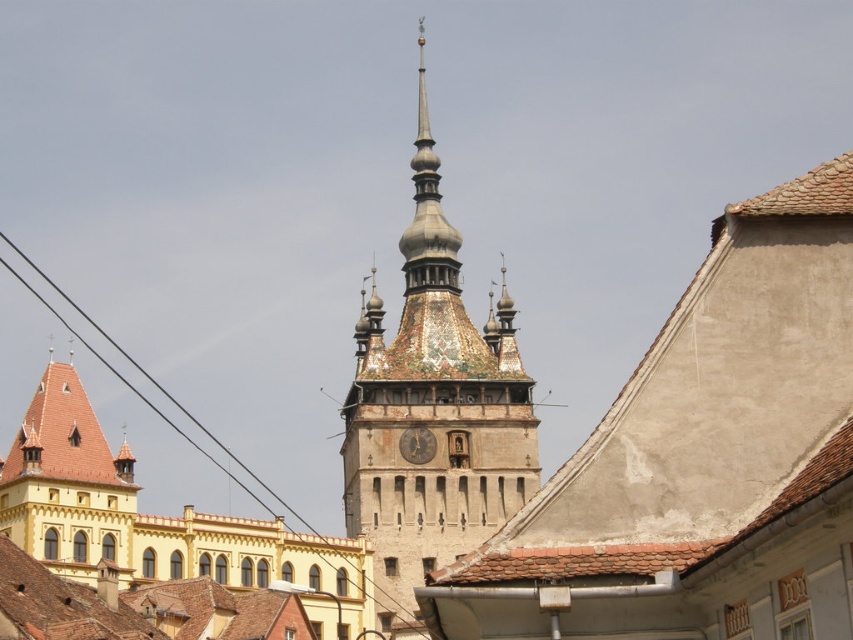
Can you confirm if multicolored mosaic clock tower at center is shorter than gold textured clock at center?

No.

Where is `multicolored mosaic clock tower at center`? The image size is (853, 640). multicolored mosaic clock tower at center is located at coordinates (433, 408).

Is point (477, 493) in front of point (329, 566)?

That is False.

Which is below, multicolored mosaic clock tower at center or yellow brick building at left?

Positioned lower is yellow brick building at left.

You are a GUI agent. You are given a task and a screenshot of the screen. Output one action in this format:
    pyautogui.click(x=<x>, y=<y>)
    Task: Click on the multicolored mosaic clock tower at center
    Image resolution: width=853 pixels, height=640 pixels.
    Given the screenshot: What is the action you would take?
    pyautogui.click(x=433, y=408)

The image size is (853, 640). I want to click on multicolored mosaic clock tower at center, so click(433, 408).

Which is in front, point (138, 490) or point (434, 440)?

Point (138, 490) is in front.

Based on the photo, does yellow brick building at left have a lesser width compared to gold textured clock at center?

No.

Identify the location of yellow brick building at left. (154, 518).